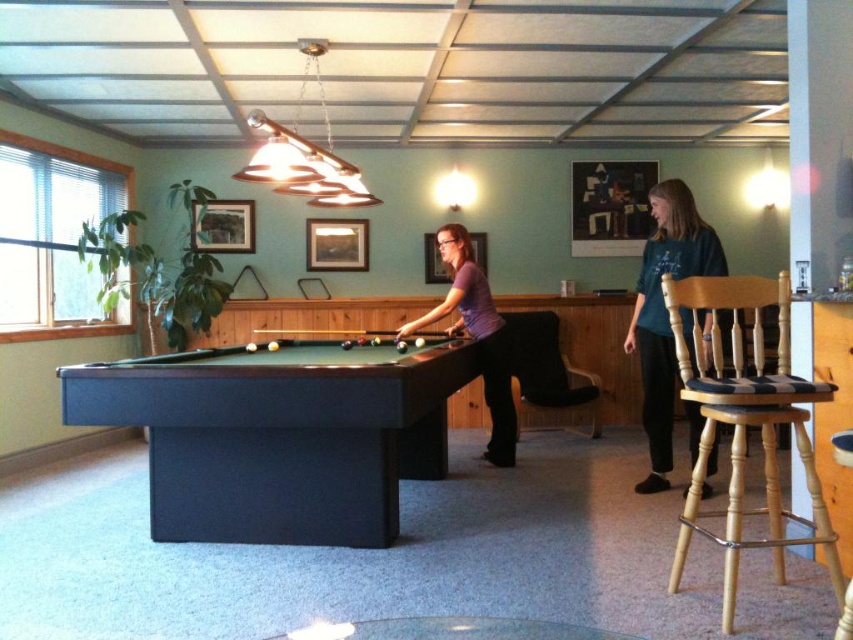
Is light wood/checked fabric bar stool at right above teal fabric shirt at right?

No.

Is point (720, 298) positioned before point (654, 298)?

That is True.

Between point (786, 545) and point (682, 180), which one is positioned in front?

Point (786, 545) is more forward.

The width and height of the screenshot is (853, 640). Identify the location of light wood/checked fabric bar stool at right. (746, 422).

Between light wood/checked fabric bar stool at right and purple matte shirt at center, which one has more height?

purple matte shirt at center

Between point (785, 372) and point (457, 278), which one is positioned in front?

Point (785, 372) is in front.

Locate an element on the screen. light wood/checked fabric bar stool at right is located at coordinates (746, 422).

Which is more to the left, dark green felt pool table at center or light wood/checked fabric bar stool at right?

Positioned to the left is dark green felt pool table at center.

Based on the photo, is the position of dark green felt pool table at center less distant than that of light wood/checked fabric bar stool at right?

No, it is not.

Who is more distant from viewer, (334, 516) or (775, 372)?

The point (775, 372) is behind.

This screenshot has height=640, width=853. I want to click on dark green felt pool table at center, so click(279, 435).